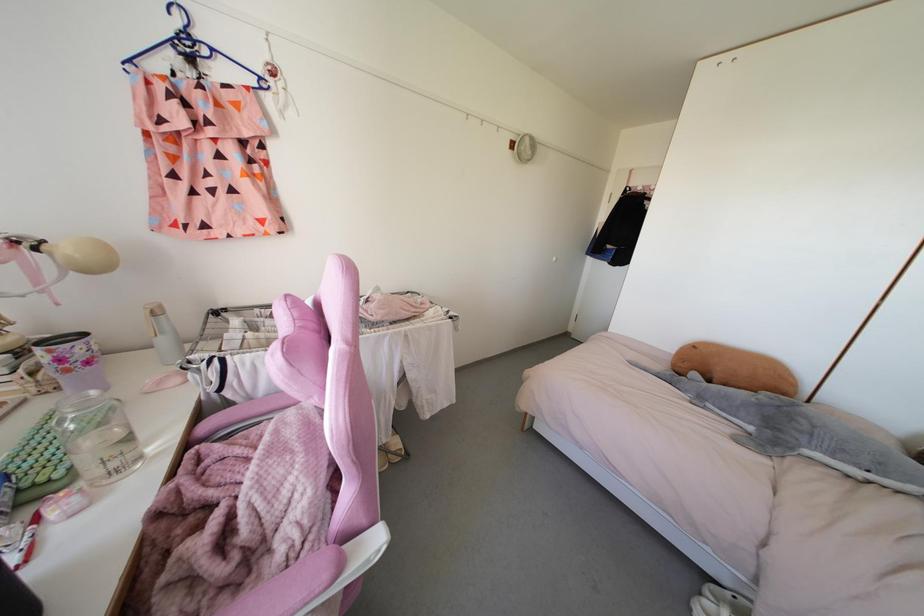
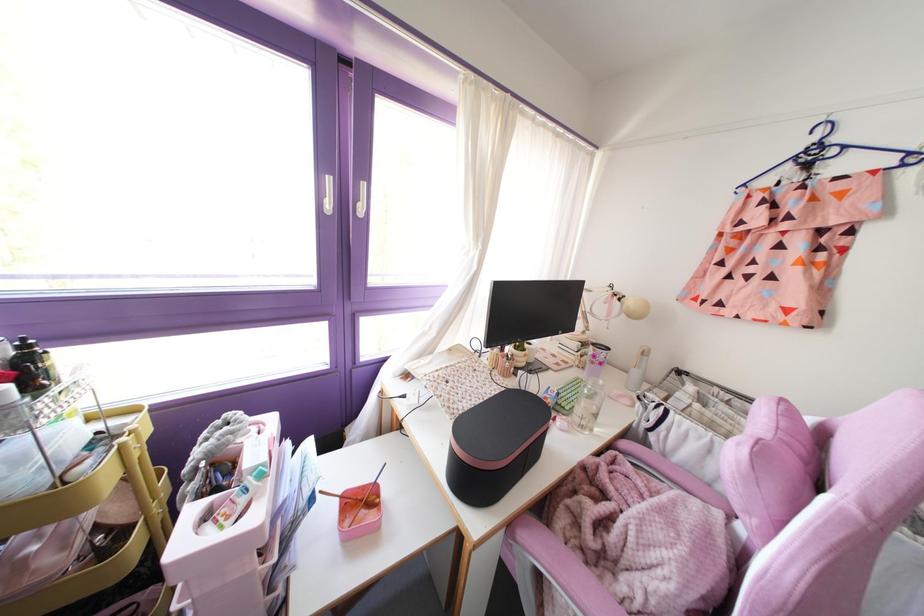
Where in the second image is the point corresponding to [263,84] from the first image?

(913, 159)